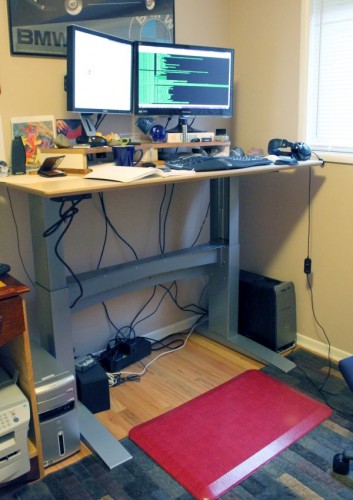
Where is `small area of a computer chair on wheels showing on the right of the image`? The height and width of the screenshot is (500, 353). small area of a computer chair on wheels showing on the right of the image is located at coordinates (347, 370), (339, 463).